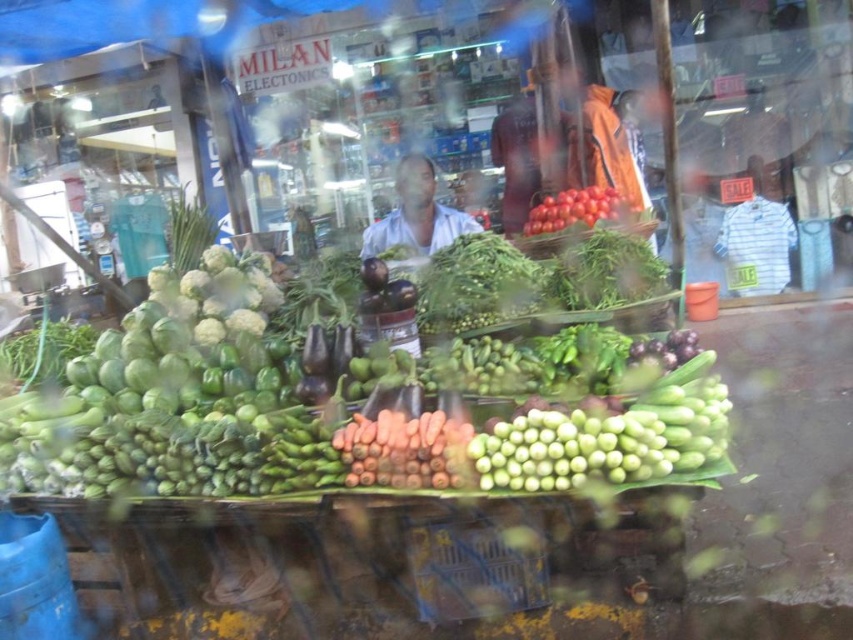
Question: Which of these objects is positioned farthest from the green matte eggplant at center?

Choices:
 (A) shiny red tomatoes at center
 (B) orange matte carrots at center
 (C) white fabric shirt at center
 (D) matte orange shirt at center

Answer: (D)

Question: From the image, what is the correct spatial relationship of white fabric shirt at center in relation to shiny red tomatoes at center?

Choices:
 (A) above
 (B) below

Answer: (A)

Question: Does green matte eggplant at center appear over orange matte carrots at center?

Choices:
 (A) no
 (B) yes

Answer: (B)

Question: Among these points, which one is farthest from the camera?

Choices:
 (A) (45, 400)
 (B) (424, 476)

Answer: (A)

Question: Is green matte eggplant at center smaller than orange matte carrots at center?

Choices:
 (A) no
 (B) yes

Answer: (A)

Question: Which of the following is the closest to the observer?

Choices:
 (A) white fabric shirt at center
 (B) shiny red tomatoes at center
 (C) matte orange shirt at center
 (D) green matte eggplant at center

Answer: (D)